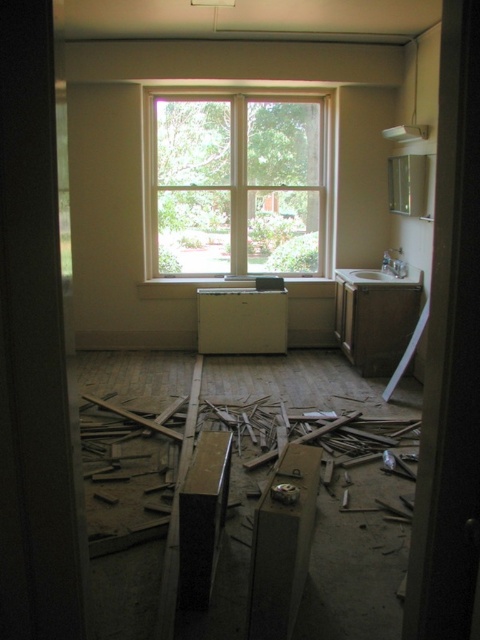
Question: Can you confirm if white matte sink at right is wider than white glossy sink at center?

Choices:
 (A) yes
 (B) no

Answer: (B)

Question: Among these objects, which one is farthest from the camera?

Choices:
 (A) clear glass window at center
 (B) white matte radiator at center
 (C) white glossy sink at center

Answer: (A)

Question: Does clear glass window at center appear on the left side of white matte sink at right?

Choices:
 (A) no
 (B) yes

Answer: (B)

Question: Is white matte radiator at center below white glossy sink at center?

Choices:
 (A) no
 (B) yes

Answer: (B)

Question: Which object is the farthest from the white matte sink at right?

Choices:
 (A) clear glass window at center
 (B) white matte radiator at center

Answer: (A)

Question: Among these objects, which one is farthest from the camera?

Choices:
 (A) white matte sink at right
 (B) white glossy sink at center
 (C) white matte radiator at center
 (D) clear glass window at center

Answer: (D)